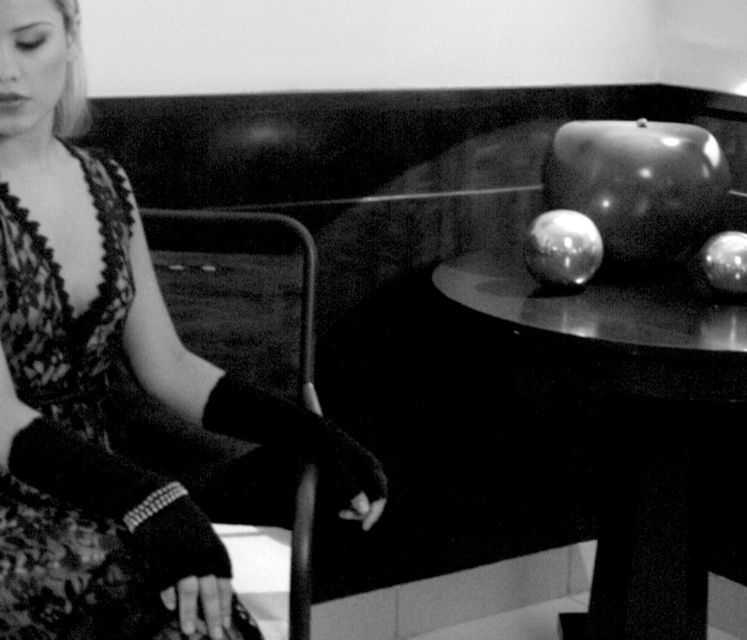
Looking at this image, you are a photographer adjusting the lighting in the studio. You need to ensure that both the glossy metallic apple at upper right and the glossy metallic apple at right are evenly lit. Based on their sizes, which apple requires a larger light source to achieve the same level of illumination?

The glossy metallic apple at upper right might be wider than the glossy metallic apple at right, so it requires a larger light source to achieve the same level of illumination.

You are a photographer setting up a shoot in the same room as the image. You need to place a 10cm wide vase between the glossy metallic table at upper right and the glossy metallic apple at right. Based on their widths, can the vase fit between them?

The glossy metallic table at upper right is wider than the glossy metallic apple at right. However, the exact widths are not provided, so we cannot determine if the 10cm vase will fit between them.